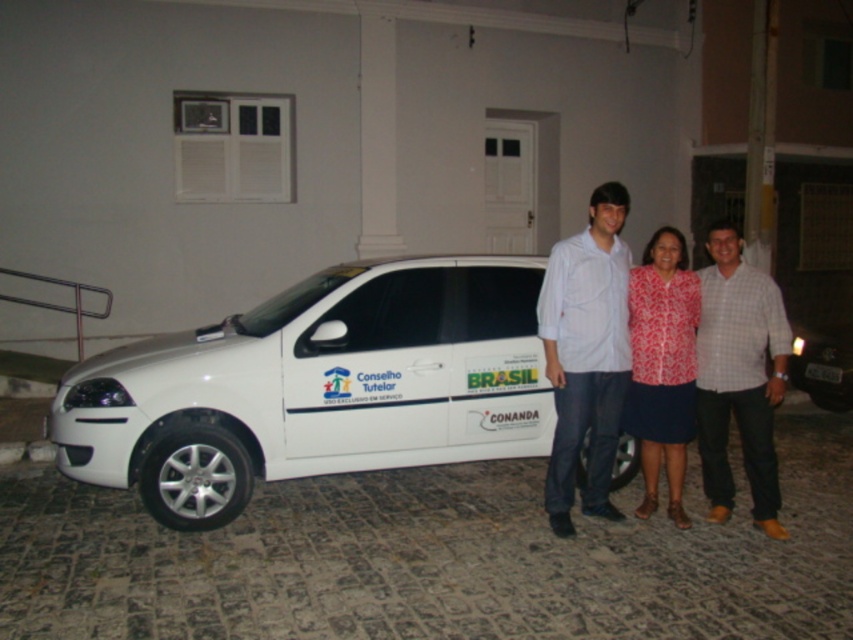
Who is positioned more to the right, patterned fabric dress at center or patterned fabric blouse at center?

From the viewer's perspective, patterned fabric blouse at center appears more on the right side.

Is point (596, 276) positioned in front of point (683, 253)?

Yes.

You are a GUI agent. You are given a task and a screenshot of the screen. Output one action in this format:
    pyautogui.click(x=<x>, y=<y>)
    Task: Click on the patterned fabric dress at center
    Image resolution: width=853 pixels, height=640 pixels.
    Given the screenshot: What is the action you would take?
    605,368

Is white matte car at center further to camera compared to patterned fabric blouse at center?

No, white matte car at center is in front of patterned fabric blouse at center.

This screenshot has height=640, width=853. What do you see at coordinates (316, 387) in the screenshot?
I see `white matte car at center` at bounding box center [316, 387].

Image resolution: width=853 pixels, height=640 pixels. I want to click on white matte car at center, so click(316, 387).

How distant is white cotton shirt at center from patterned fabric blouse at center?

white cotton shirt at center and patterned fabric blouse at center are 12.78 inches apart.

Does white cotton shirt at center lie in front of patterned fabric blouse at center?

That is True.

Is point (593, 513) in front of point (693, 388)?

That is False.

The width and height of the screenshot is (853, 640). Find the location of `white cotton shirt at center`. white cotton shirt at center is located at coordinates (585, 355).